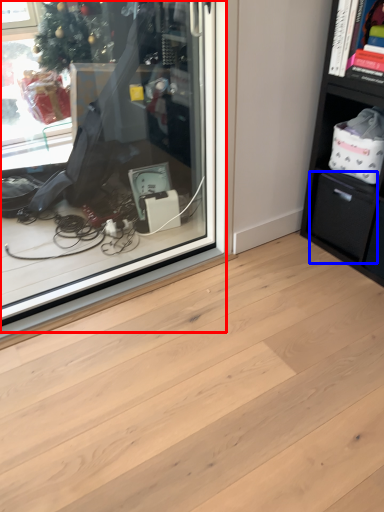
Question: Which of the following is the farthest to the observer, shop window (highlighted by a red box) or drawer (highlighted by a blue box)?

Choices:
 (A) shop window
 (B) drawer

Answer: (B)